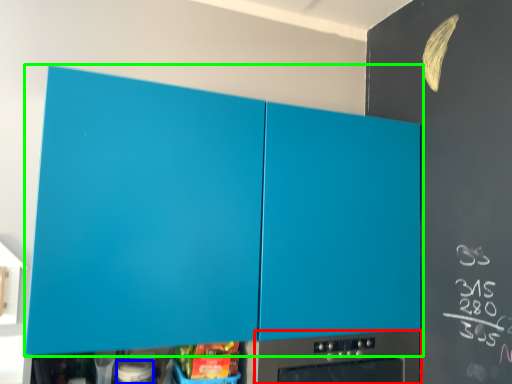
Question: Based on their relative distances, which object is nearer to home appliance (highlighted by a red box)? Choose from appliance (highlighted by a blue box) and cabinetry (highlighted by a green box).

Choices:
 (A) appliance
 (B) cabinetry

Answer: (B)